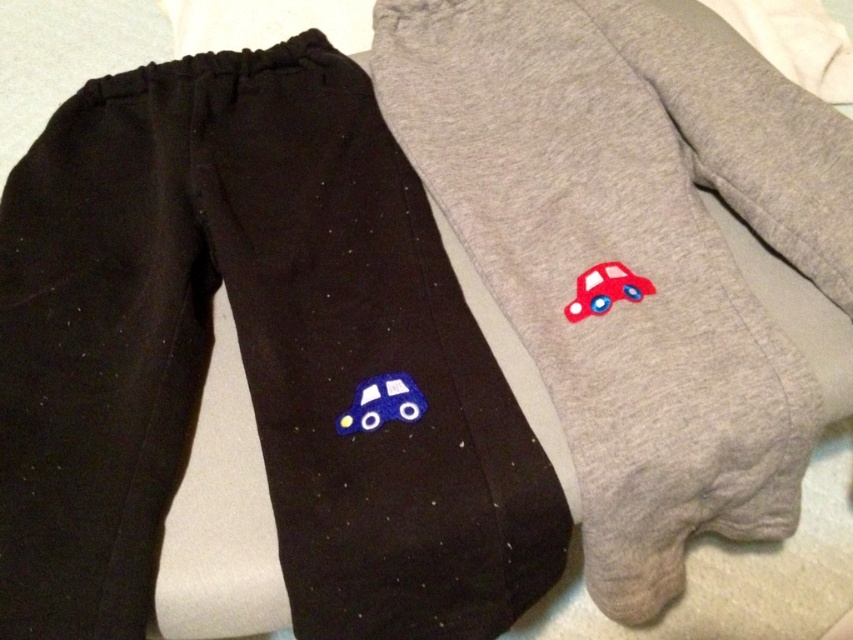
You are organizing a child care center and need to place the matte black pants at left and the felt blue car at lower left into a storage bin. The bin has a height limit of 10 cm. Can you fit both items without exceeding the height limit?

The matte black pants at left is located above the felt blue car at lower left. Since the pants are placed above the car, their combined height would exceed the 10 cm limit. Therefore, you cannot fit both items into the bin without exceeding the height limit.

You are organizing a childrens clothing store and need to arrange these two items so that the felt blue car at lower left is visible above the matte fabric car at right. Can you do this by rotating the items?

The felt blue car at lower left is currently located below the matte fabric car at right. To position it above, you can rotate the garments so that their orientations change, allowing the felt blue car at lower left to be placed in a higher position relative to the matte fabric car at right.